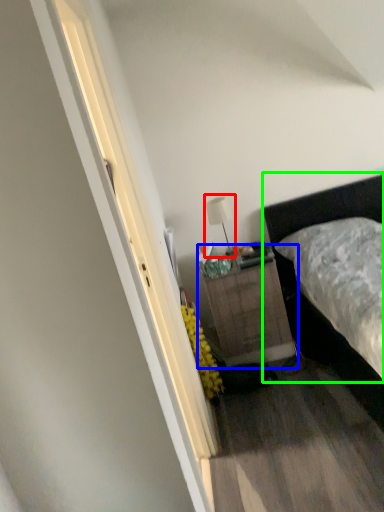
Question: Which object is the closest to the table lamp (highlighted by a red box)? Choose among these: nightstand (highlighted by a blue box) or bed (highlighted by a green box).

Choices:
 (A) nightstand
 (B) bed

Answer: (A)